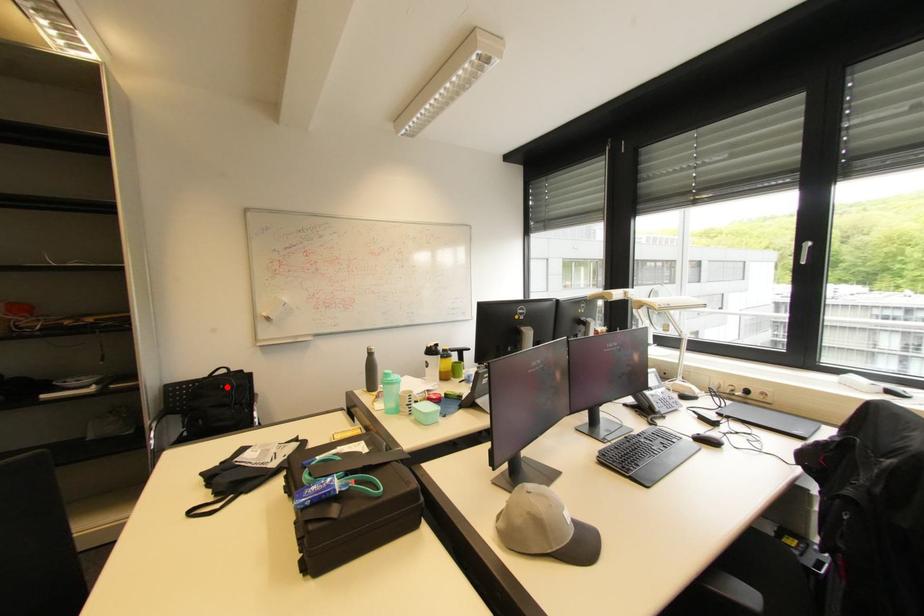
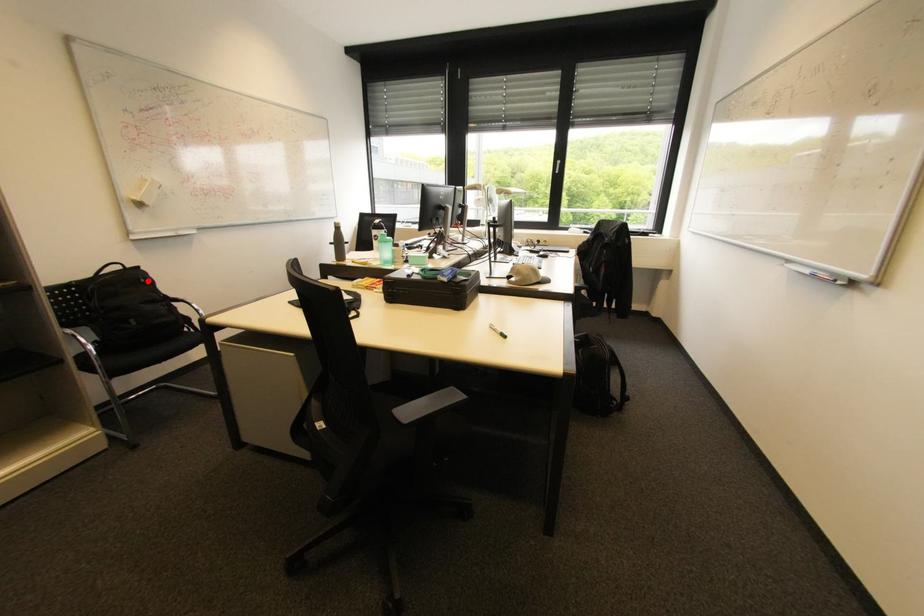
I am providing you with two images of the same scene from different viewpoints. A red point is marked on the first image and another point is marked on the second image. Is the red point in image1 aligned with the point shown in image2?

Yes